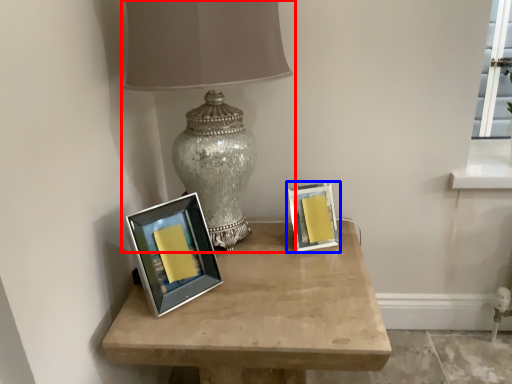
Question: Which of the following is the farthest to the observer, lamp (highlighted by a red box) or picture frame (highlighted by a blue box)?

Choices:
 (A) lamp
 (B) picture frame

Answer: (B)